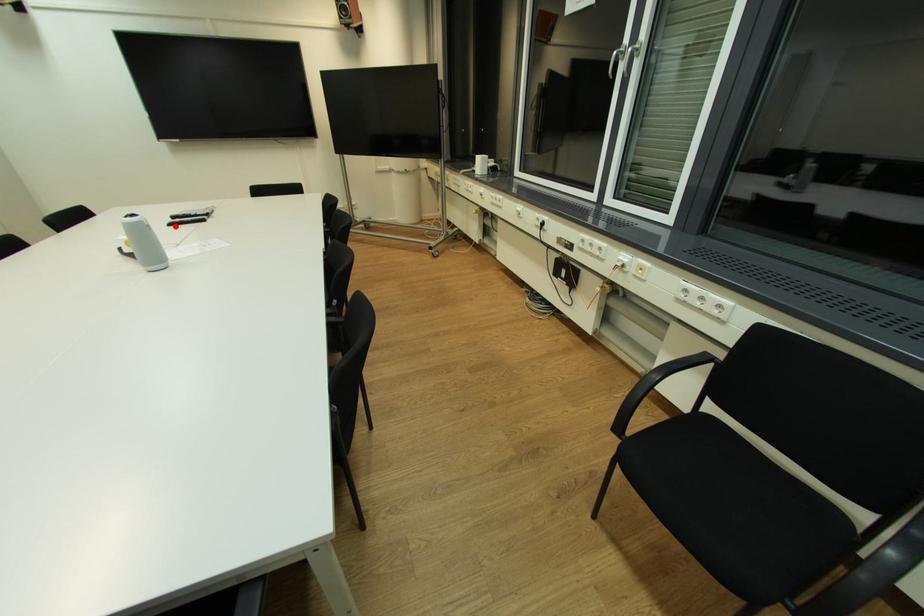
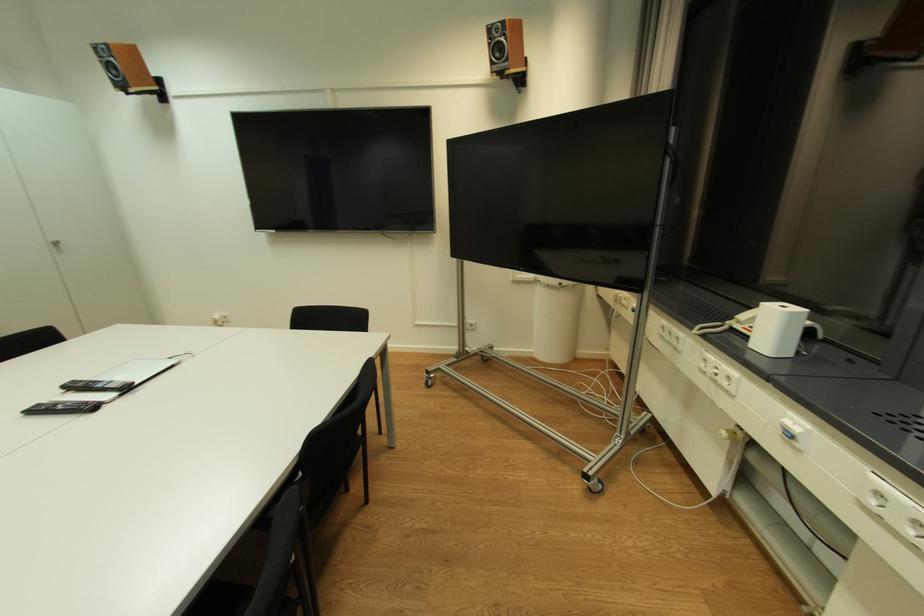
Find the pixel in the second image that matches the highlighted location in the first image.

(43, 411)